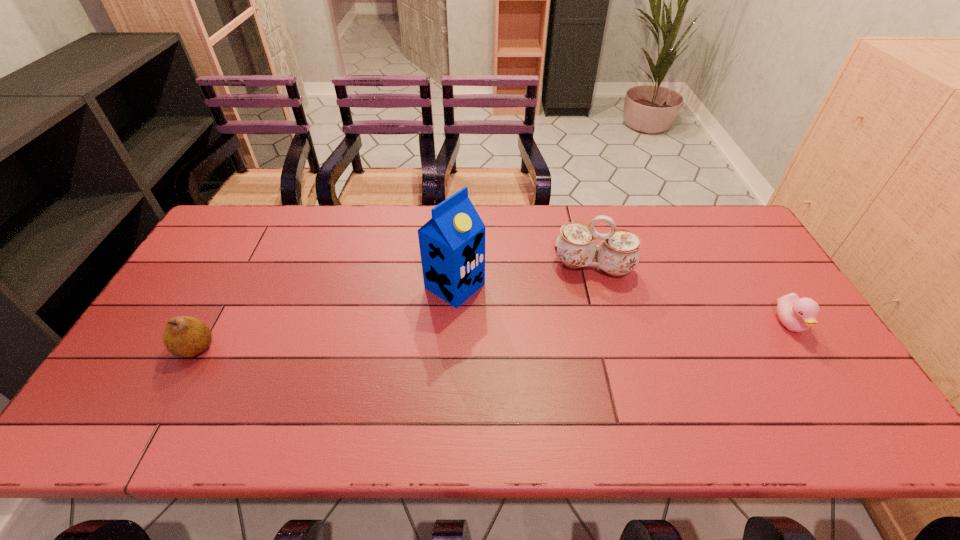
At what (x,y) coordinates should I click in order to perform the action: click on vacant spot on the desktop that is between the third tallest object and the shortest object and is positioned with the cap open on the second object from left to right. Please return your answer as a coordinate pair (x, y). The width and height of the screenshot is (960, 540). Looking at the image, I should click on (533, 334).

This screenshot has width=960, height=540. I want to click on vacant space on the desktop that is between the pear and the duckling and is positioned by the handle of the chinaware, so click(x=584, y=332).